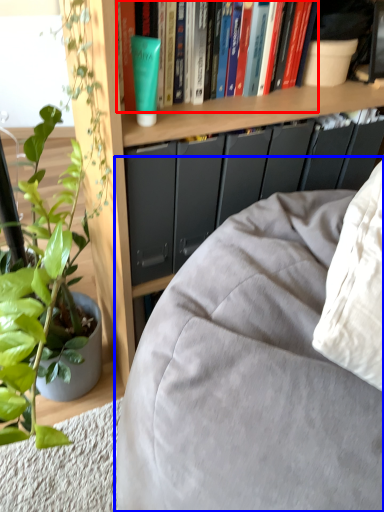
Question: Which object is further to the camera taking this photo, book (highlighted by a red box) or studio couch (highlighted by a blue box)?

Choices:
 (A) book
 (B) studio couch

Answer: (A)